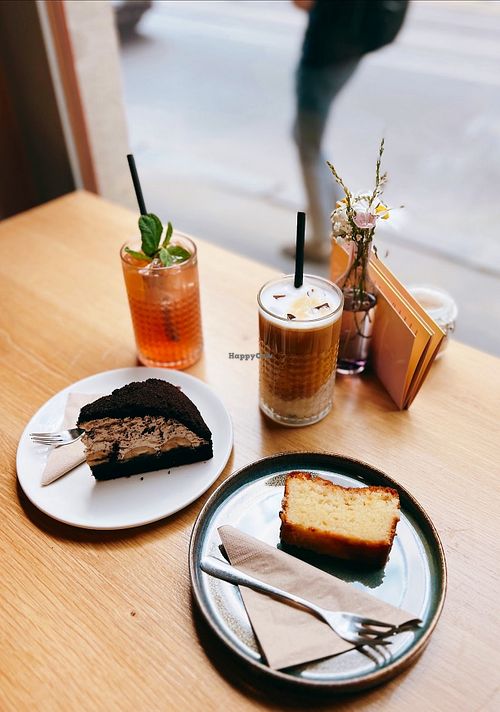
The image size is (500, 712). In order to click on napkin in this screenshot , I will do `click(277, 570)`.